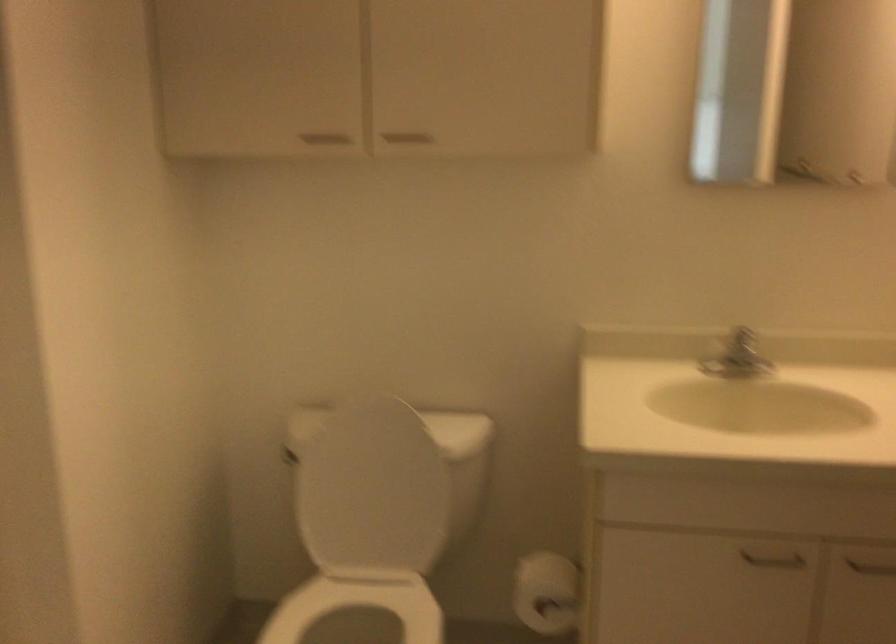
You are a GUI agent. You are given a task and a screenshot of the screen. Output one action in this format:
    pyautogui.click(x=<x>, y=<y>)
    Task: Click on the white toilet lid
    
    Given the screenshot: What is the action you would take?
    pyautogui.click(x=373, y=491)